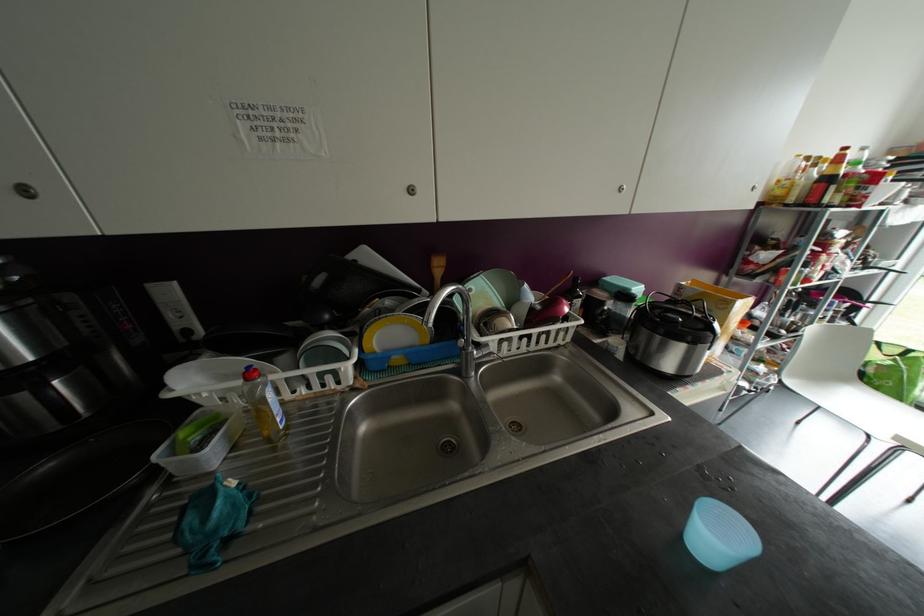
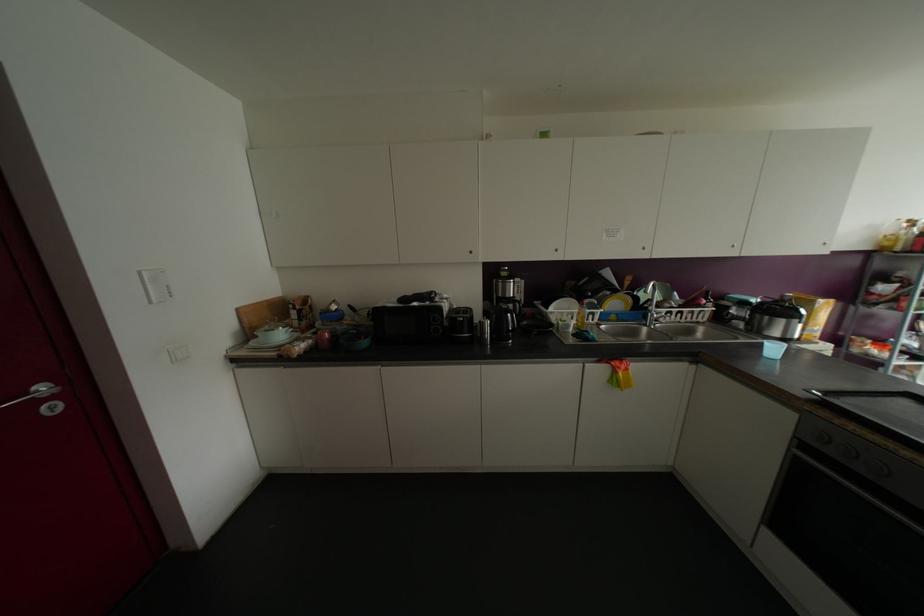
In a continuous first-person perspective shot, in which direction is the camera moving?

The cameraman walked toward left, backward.